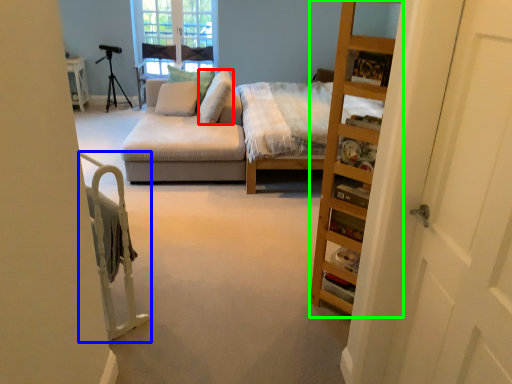
Question: Estimate the real-world distances between objects in this image. Which object is farther from pillow (highlighted by a red box), bed frame (highlighted by a blue box) or cabinet (highlighted by a green box)?

Choices:
 (A) bed frame
 (B) cabinet

Answer: (B)